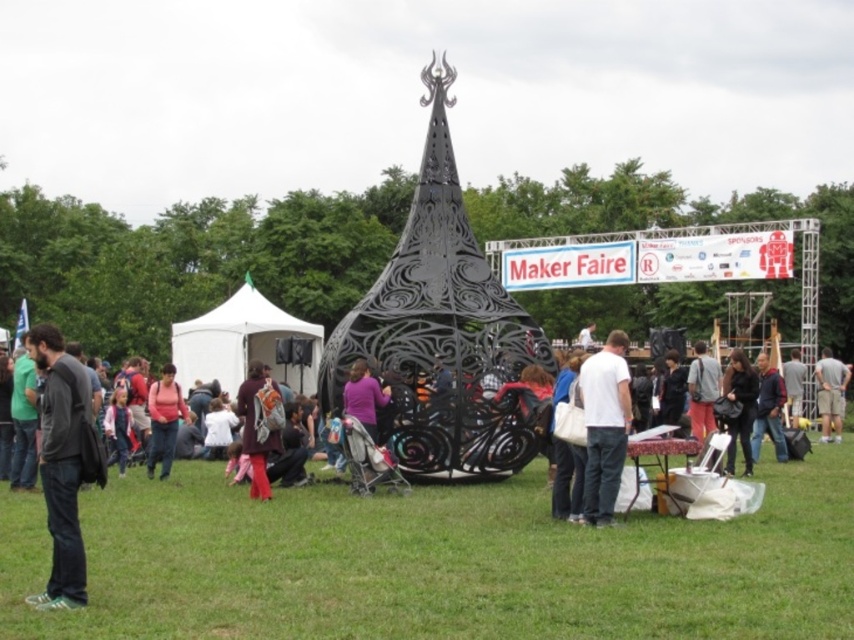
Measure the distance from white fabric tent at center to matte pink shirt at center.

A distance of 97.87 feet exists between white fabric tent at center and matte pink shirt at center.

Is white fabric tent at center below matte pink shirt at center?

No.

Find the location of a particular element. The image size is (854, 640). white fabric tent at center is located at coordinates (246, 342).

Looking at this image, is white fabric tent at center wider than light brown leather jacket at center?

Indeed, white fabric tent at center has a greater width compared to light brown leather jacket at center.

Which is more to the left, white fabric tent at center or light brown leather jacket at center?

From the viewer's perspective, white fabric tent at center appears more on the left side.

At what (x,y) coordinates should I click in order to perform the action: click on white fabric tent at center. Please return your answer as a coordinate pair (x, y). Looking at the image, I should click on (246, 342).

Between denim jacket at center and gray fabric pants at lower right, which one appears on the right side from the viewer's perspective?

From the viewer's perspective, gray fabric pants at lower right appears more on the right side.

At what (x,y) coordinates should I click in order to perform the action: click on denim jacket at center. Please return your answer as a coordinate pair (x, y). The image size is (854, 640). Looking at the image, I should click on (702, 390).